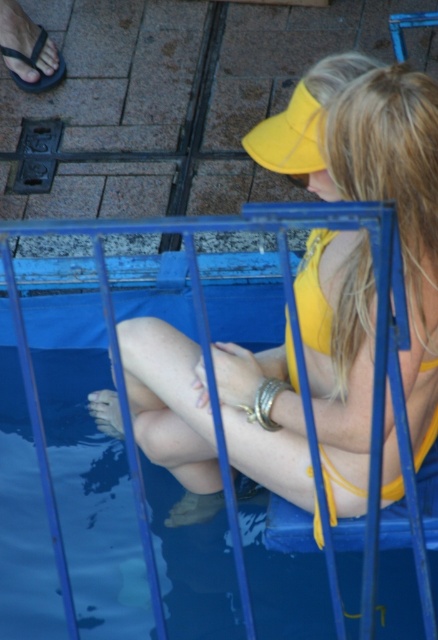
Who is shorter, blue plastic pool at center or yellow fabric bikini top at upper center?

With less height is yellow fabric bikini top at upper center.

Does blue plastic pool at center have a greater height compared to yellow fabric bikini top at upper center?

Yes, blue plastic pool at center is taller than yellow fabric bikini top at upper center.

Locate an element on the screen. Image resolution: width=438 pixels, height=640 pixels. blue plastic pool at center is located at coordinates click(x=208, y=333).

Identify the location of blue plastic pool at center. (208, 333).

Is blue plastic pool at center wider than black rubber sandal at upper left?

Yes.

Is blue plastic pool at center thinner than black rubber sandal at upper left?

No.

Between point (165, 227) and point (24, 86), which one is positioned behind?

Positioned behind is point (24, 86).

Find the location of `blue plastic pool at center`. blue plastic pool at center is located at coordinates (208, 333).

Does yellow matte bikini top at center have a lesser width compared to black rubber sandal at upper left?

Incorrect, yellow matte bikini top at center's width is not less than black rubber sandal at upper left's.

Is yellow matte bikini top at center further to camera compared to black rubber sandal at upper left?

No.

Based on the photo, who is more distant from viewer, (x=361, y=257) or (x=62, y=76)?

The point (x=62, y=76) is behind.

I want to click on yellow matte bikini top at center, so click(374, 184).